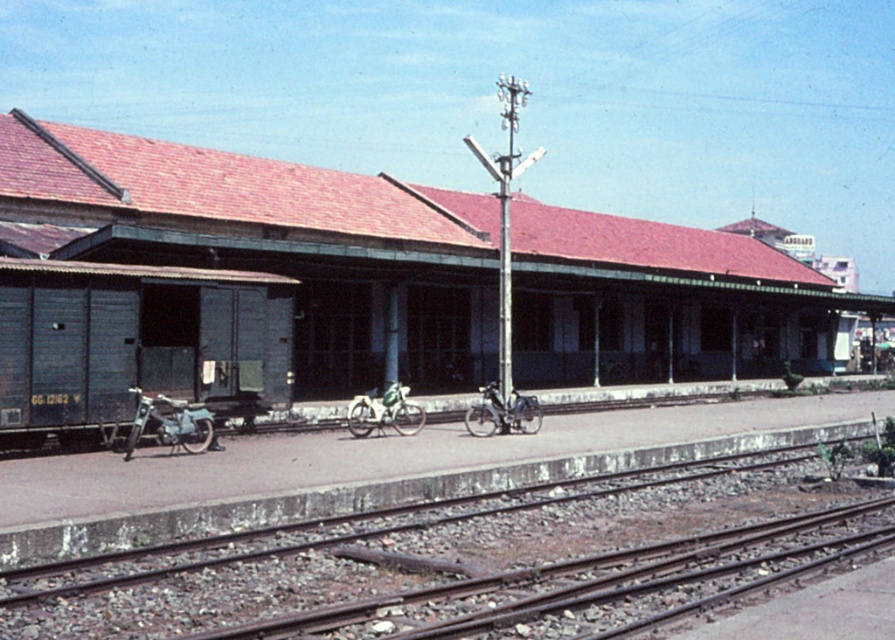
You are a station attendant who needs to place a new bench between the brown metal tracks at lower center and the green matte bicycle at center. Since the bench is 1.2 meters wide, will it fit in the space between them?

The brown metal tracks at lower center is bigger than green matte bicycle at center, so the space between them may be sufficient for a 1.2 meter bench. However, the exact dimensions aren

You are a passenger waiting at the station and need to walk from the shiny metallic bicycle at center to the entrance of the station building. Which direction should you move relative to the brown metal tracks at lower center?

To reach the station entrance from the shiny metallic bicycle at center, you should move to the left side of the brown metal tracks at lower center since the tracks are positioned on the right side of the bicycle.